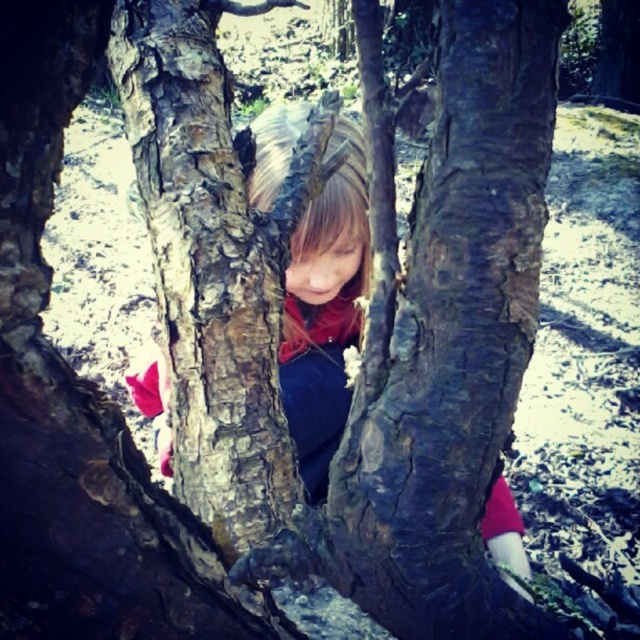
You are a photographer trying to capture the matte red shirt at center and the smooth bark tree trunk at center in a single frame. Which object should you focus on first to ensure both are in the frame without cropping?

You should focus on the smooth bark tree trunk at center first because it occupies less space than the matte red shirt at center, so it will be easier to fit both into the frame without cropping.

You are trying to see the child playing hide and seek in the forest. You can see the smooth bark tree trunk at center and the matte red shirt at center. Which object is closer to you?

The smooth bark tree trunk at center is closer to the viewer than the matte red shirt at center, so the smooth bark tree trunk at center is closer to you.